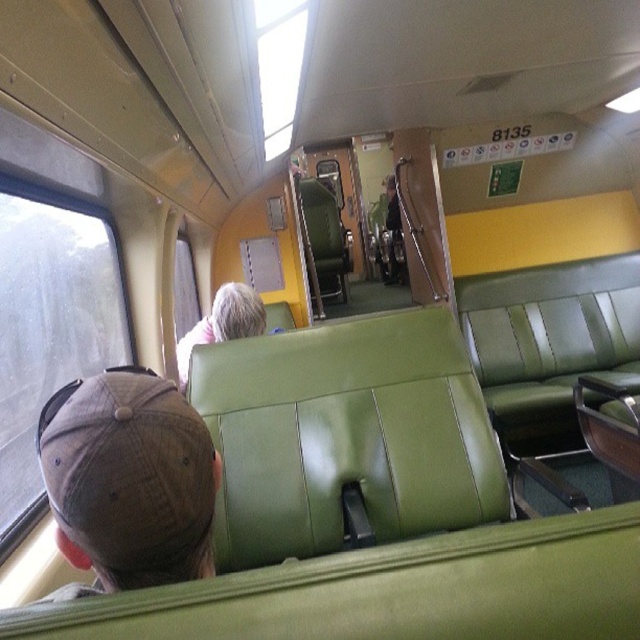
Question: Is transparent glass window at left positioned behind transparent glass window at upper center?

Choices:
 (A) yes
 (B) no

Answer: (A)

Question: Is transparent glass window at left positioned at the back of gray matte hair at center?

Choices:
 (A) no
 (B) yes

Answer: (A)

Question: Which object is farther from the camera taking this photo?

Choices:
 (A) brown fabric baseball cap at lower left
 (B) gray matte hair at center
 (C) transparent glass window at left

Answer: (B)

Question: Does transparent glass window at left appear on the left side of transparent glass window at upper center?

Choices:
 (A) yes
 (B) no

Answer: (A)

Question: Among these objects, which one is nearest to the camera?

Choices:
 (A) transparent glass window at left
 (B) gray matte hair at center

Answer: (A)

Question: Based on their relative distances, which object is nearer to the transparent glass window at left?

Choices:
 (A) gray matte hair at center
 (B) transparent glass window at upper center
 (C) brown fabric baseball cap at lower left

Answer: (A)